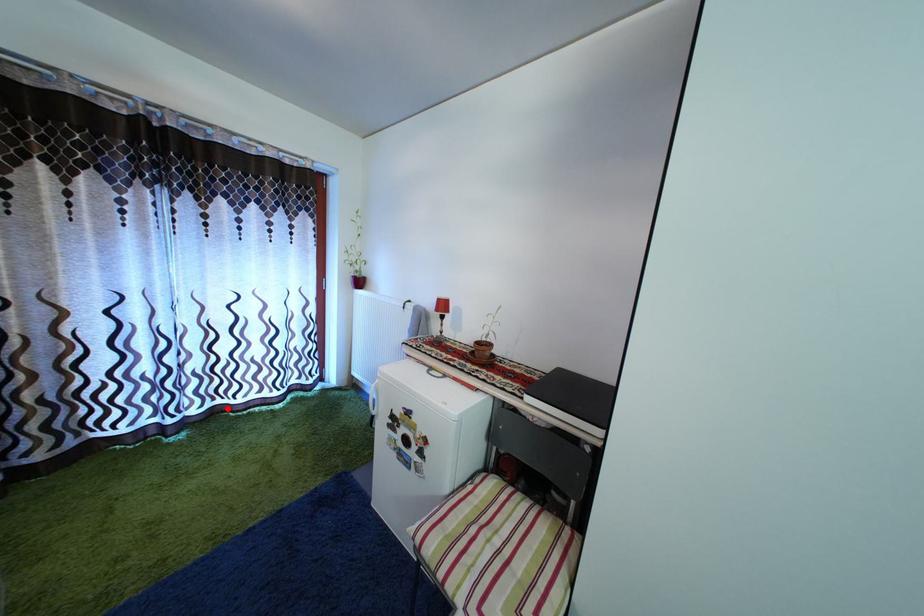
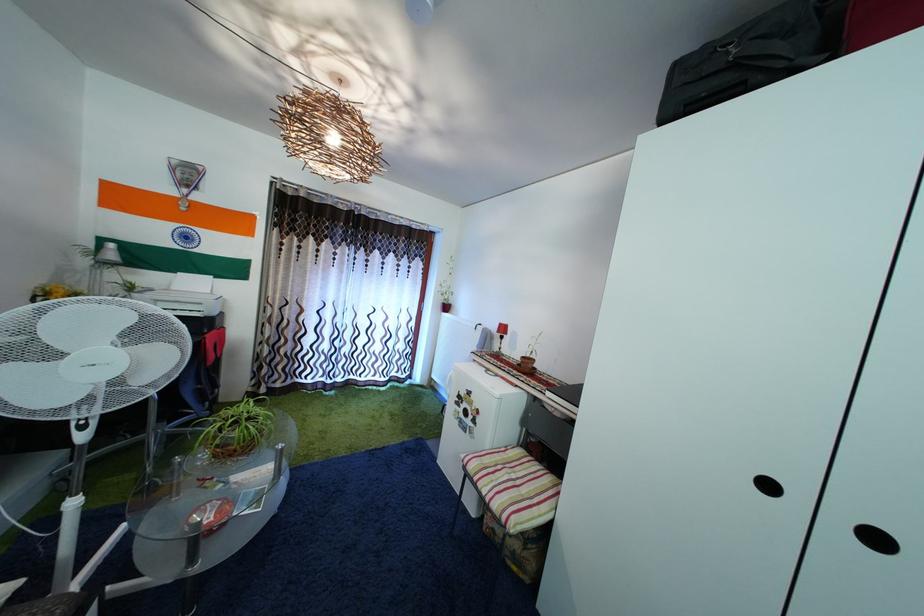
The point at the highlighted location is marked in the first image. Where is the corresponding point in the second image?

(359, 384)